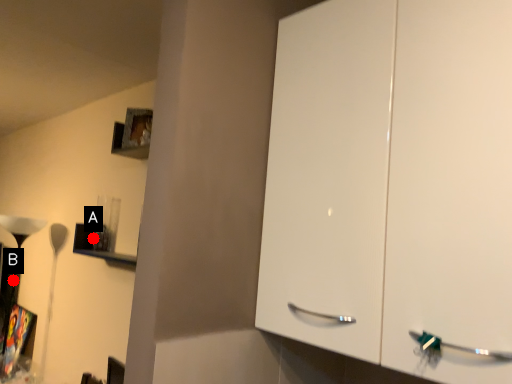
Question: Two points are circled on the image, labeled by A and B beside each circle. Among these points, which one is nearest to the camera?

Choices:
 (A) A is closer
 (B) B is closer

Answer: (A)